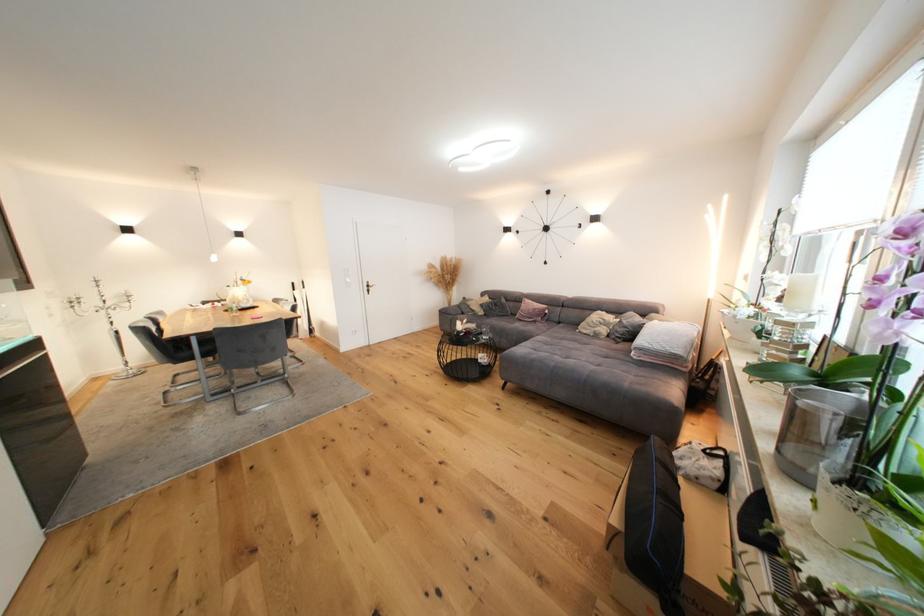
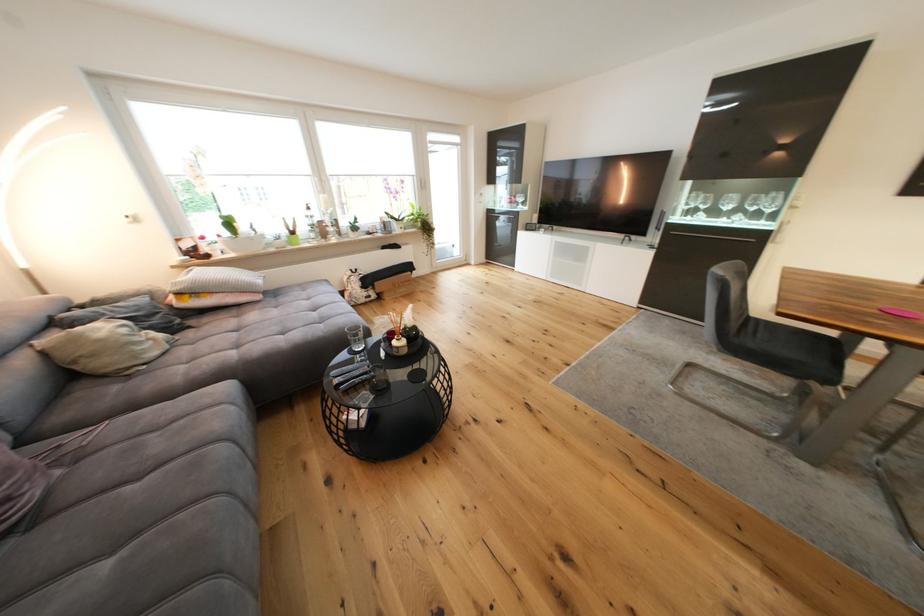
Locate, in the second image, the point that corresponds to point (611, 331) in the first image.

(161, 336)